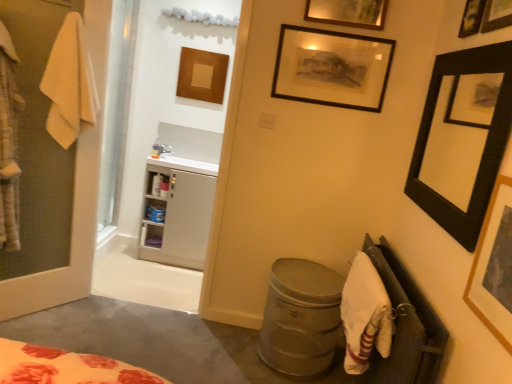
Question: From a real-world perspective, relative to white cotton bath towel at lower right, the first bath towel from the bottom, is wooden framed picture at upper right, the fifth picture frame positioned from the left, vertically above or below?

Choices:
 (A) above
 (B) below

Answer: (A)

Question: Based on their sizes in the image, would you say wooden framed picture at upper right, which is the second picture frame in front-to-back order, is bigger or smaller than white cotton bath towel at lower right, the first bath towel from the bottom?

Choices:
 (A) big
 (B) small

Answer: (B)

Question: Which is nearer to the white glossy sink at upper left?

Choices:
 (A) black matte picture frame at upper right, the 3th picture frame in the back-to-front sequence
 (B) wooden square frame at upper center, placed as the 5th picture frame when sorted from right to left
 (C) white cotton bath towel at lower right, the first bath towel from the bottom
 (D) black matte picture frame at upper center, positioned as the fourth picture frame in right-to-left order
 (E) yellow cotton towel at left, the 1th bath towel positioned from the left

Answer: (B)

Question: Which object is positioned closest to the black matte picture frame at upper right, the second picture frame from the right?

Choices:
 (A) white cotton bath towel at lower right, which ranks as the second bath towel in left-to-right order
 (B) white fabric at lower right
 (C) white glossy sink at upper left
 (D) yellow cotton towel at left, the 2th bath towel when ordered from right to left
 (E) wooden framed picture at upper right, the fourth picture frame from the back

Answer: (E)